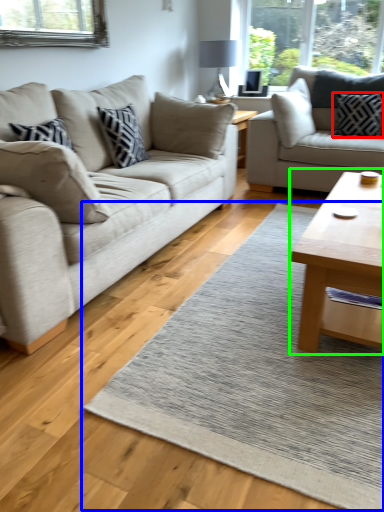
Question: Estimate the real-world distances between objects in this image. Which object is closer to pillow (highlighted by a red box), mat (highlighted by a blue box) or coffee table (highlighted by a green box)?

Choices:
 (A) mat
 (B) coffee table

Answer: (B)